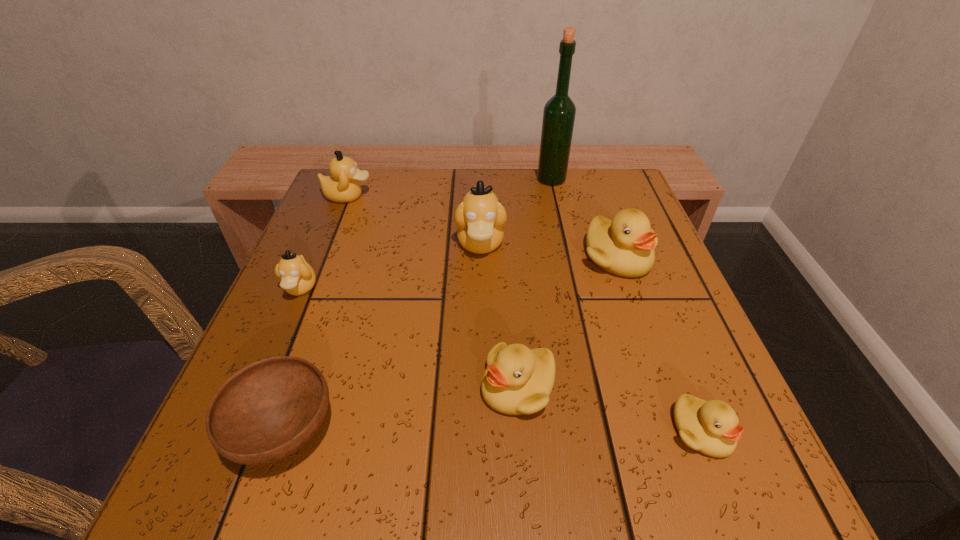
Locate an element on the screen. The width and height of the screenshot is (960, 540). tan duckling that stands as the second closest to the bowl is located at coordinates (480, 218).

Select which yellow duckling is the third closest to the liquor. Please provide its 2D coordinates. Your answer should be formatted as a tuple, i.e. [(x, y)], where the tuple contains the x and y coordinates of a point satisfying the conditions above.

[(711, 427)]

Where is `yellow duckling that stands as the closest to the smallest yellow duckling`? The width and height of the screenshot is (960, 540). yellow duckling that stands as the closest to the smallest yellow duckling is located at coordinates (517, 380).

Find the location of a particular element. The height and width of the screenshot is (540, 960). vacant space that satisfies the following two spatial constraints: 1. on the face of the second farthest object; 2. on the right side of the bowl is located at coordinates (254, 432).

This screenshot has width=960, height=540. In order to click on free space that satisfies the following two spatial constraints: 1. on the face of the nearest tan duckling; 2. on the right side of the bowl in this screenshot , I will do `click(240, 432)`.

Where is `vacant space that satisfies the following two spatial constraints: 1. on the front side of the green liquor; 2. on the face of the second farthest object`? This screenshot has width=960, height=540. vacant space that satisfies the following two spatial constraints: 1. on the front side of the green liquor; 2. on the face of the second farthest object is located at coordinates (555, 197).